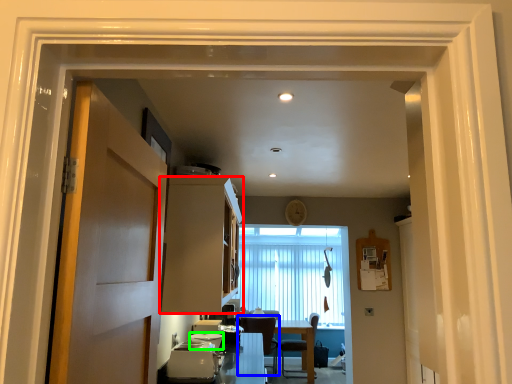
Question: Which is nearer to the cabinetry (highlighted by a red box)? chair (highlighted by a blue box) or appliance (highlighted by a green box).

Choices:
 (A) chair
 (B) appliance

Answer: (B)